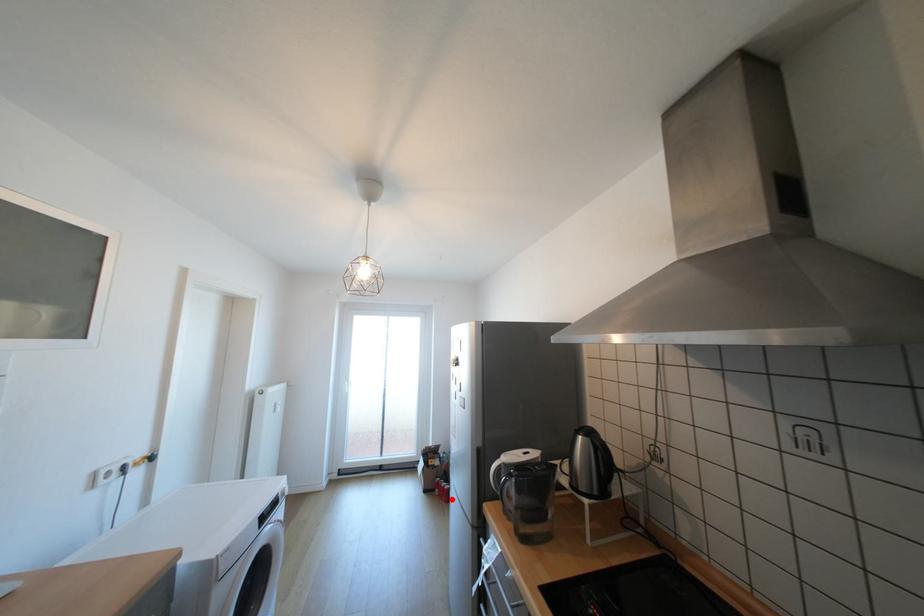
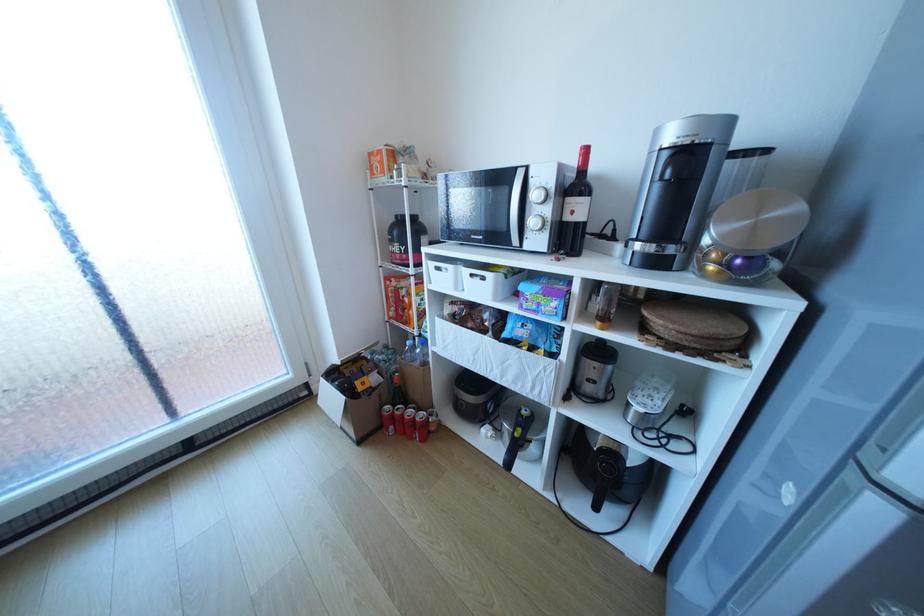
Where in the second image is the point corresponding to the highlighted location from the first image?

(420, 438)